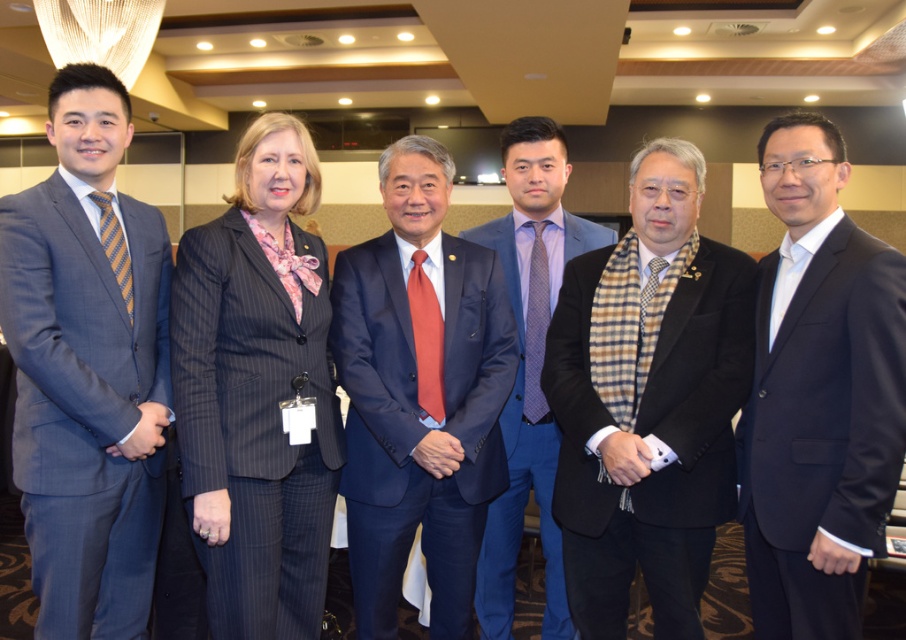
Question: Is purple dotted tie at center bigger than striped silk tie at left?

Choices:
 (A) yes
 (B) no

Answer: (A)

Question: Which object appears closest to the camera in this image?

Choices:
 (A) navy blue wool suit at center
 (B) dark blue pinstripe suit at center
 (C) matte red tie at center
 (D) black woolen suit at center

Answer: (A)

Question: Among these objects, which one is farthest from the camera?

Choices:
 (A) matte red tie at center
 (B) dark blue pinstripe suit at center
 (C) purple dotted tie at center
 (D) matte gray suit at left

Answer: (C)

Question: Is matte gray suit at left to the left of purple textured tie at center from the viewer's perspective?

Choices:
 (A) no
 (B) yes

Answer: (B)

Question: Is matte gray suit at left to the left of matte red tie at center from the viewer's perspective?

Choices:
 (A) no
 (B) yes

Answer: (B)

Question: Which of the following is the closest to the observer?

Choices:
 (A) (278, 604)
 (B) (113, 252)
 (C) (52, 301)
 (D) (413, 284)

Answer: (C)